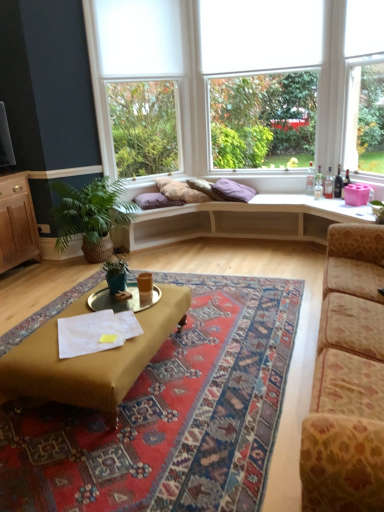
What do you see at coordinates (169, 415) in the screenshot? I see `carpeted rug at center` at bounding box center [169, 415].

In order to face green matte plant at center, which is the 2th houseplant in back-to-front order, should I rotate leftwards or rightwards?

To face it directly, rotate left by 10.085 degrees.

Locate an element on the screen. The image size is (384, 512). green matte plant at center, which is the 2th houseplant in back-to-front order is located at coordinates (116, 275).

What is the approximate height of purple fabric pillow at center, marked as the second pillow in a right-to-left arrangement?

purple fabric pillow at center, marked as the second pillow in a right-to-left arrangement, is 18.32 centimeters in height.

This screenshot has height=512, width=384. Find the location of `mustard fabric coffee table at center`. mustard fabric coffee table at center is located at coordinates (89, 359).

The height and width of the screenshot is (512, 384). I want to click on white fabric blind at upper center, so click(x=260, y=35).

How much space does green leafy plant at left, which is counted as the 2th houseplant, starting from the front, occupy vertically?

green leafy plant at left, which is counted as the 2th houseplant, starting from the front, is 32.29 inches tall.

Where is `carpeted rug at center`? The width and height of the screenshot is (384, 512). carpeted rug at center is located at coordinates (169, 415).

In the scene shown: Does metallic gold cocktail table at center have a greater height compared to purple fabric pillow at center, the 1th pillow in the left-to-right sequence?

No.

Considering the positions of point (152, 294) and point (155, 201), is point (152, 294) closer or farther from the camera than point (155, 201)?

Point (152, 294) is positioned closer to the camera compared to point (155, 201).

From the image's perspective, is metallic gold cocktail table at center located above purple fabric pillow at center, marked as the second pillow in a right-to-left arrangement?

No, from the image's perspective, metallic gold cocktail table at center is not over purple fabric pillow at center, marked as the second pillow in a right-to-left arrangement.

From the picture: Is purple fabric pillow at center, the 1th pillow in the left-to-right sequence, turned away from white fabric blind at upper center?

No, white fabric blind at upper center is not at the back of purple fabric pillow at center, the 1th pillow in the left-to-right sequence.

Can white fabric blind at upper center be found inside purple fabric pillow at center, the 1th pillow in the left-to-right sequence?

That's incorrect, white fabric blind at upper center is not inside purple fabric pillow at center, the 1th pillow in the left-to-right sequence.

Which object is positioned more to the left, purple fabric pillow at center, marked as the second pillow in a right-to-left arrangement, or white fabric blind at upper center?

purple fabric pillow at center, marked as the second pillow in a right-to-left arrangement, is more to the left.

Would you say purple fabric pillow at center, the 1th pillow in the left-to-right sequence, contains mustard fabric coffee table at center?

No, purple fabric pillow at center, the 1th pillow in the left-to-right sequence, does not contain mustard fabric coffee table at center.

Is purple fabric pillow at center, marked as the second pillow in a right-to-left arrangement, further to the viewer compared to mustard fabric coffee table at center?

Yes, purple fabric pillow at center, marked as the second pillow in a right-to-left arrangement, is behind mustard fabric coffee table at center.

Starting from the mustard fabric coffee table at center, which pillow is the 1st one to the right? Please provide its 2D coordinates.

[(155, 201)]

From the image's perspective, is purple fabric pillow at center, the 1th pillow in the left-to-right sequence, positioned above or below mustard fabric coffee table at center?

purple fabric pillow at center, the 1th pillow in the left-to-right sequence, is above mustard fabric coffee table at center.

How different are the orientations of carpeted rug at center and green matte plant at center, which is the 2th houseplant in back-to-front order, in degrees?

There is a 176-degree angle between the facing directions of carpeted rug at center and green matte plant at center, which is the 2th houseplant in back-to-front order.

From a real-world perspective, is carpeted rug at center positioned under green matte plant at center, acting as the first houseplant starting from the front, based on gravity?

Yes, from a real-world perspective, carpeted rug at center is beneath green matte plant at center, acting as the first houseplant starting from the front.

Between carpeted rug at center and green matte plant at center, acting as the first houseplant starting from the front, which one appears on the right side from the viewer's perspective?

carpeted rug at center is more to the right.

Is point (237, 289) farther from camera compared to point (126, 276)?

Yes, it is.

Would you say light wood futon at center is inside or outside mustard fabric coffee table at center?

light wood futon at center is not enclosed by mustard fabric coffee table at center.

Between point (206, 209) and point (155, 322), which one is positioned in front?

Positioned in front is point (155, 322).

From a real-world perspective, which object rests below the other?

From a 3D spatial view, mustard fabric coffee table at center is below.

How different are the orientations of light wood futon at center and mustard fabric coffee table at center in degrees?

88.6 degrees separate the facing orientations of light wood futon at center and mustard fabric coffee table at center.

Is leopard print fabric couch at right directly adjacent to purple cotton pillow at center, which is the 2th pillow from left to right?

No, leopard print fabric couch at right is not touching purple cotton pillow at center, which is the 2th pillow from left to right.

From the image's perspective, who appears lower, leopard print fabric couch at right or purple cotton pillow at center, positioned as the 1th pillow in right-to-left order?

leopard print fabric couch at right.

Does leopard print fabric couch at right contain purple cotton pillow at center, positioned as the 1th pillow in right-to-left order?

Actually, purple cotton pillow at center, positioned as the 1th pillow in right-to-left order, is outside leopard print fabric couch at right.

From the image's perspective, is white fabric blind at upper center located above or below green leafy plant at left, which is counted as the 2th houseplant, starting from the front?

Based on their image positions, white fabric blind at upper center is located above green leafy plant at left, which is counted as the 2th houseplant, starting from the front.

Who is smaller, white fabric blind at upper center or green leafy plant at left, which is counted as the 2th houseplant, starting from the front?

Smaller between the two is white fabric blind at upper center.

Is white fabric blind at upper center positioned with its back to green leafy plant at left, the first houseplant in the back-to-front sequence?

No, white fabric blind at upper center is not facing the opposite direction of green leafy plant at left, the first houseplant in the back-to-front sequence.

From a real-world perspective, which is physically above, white fabric blind at upper center or green leafy plant at left, the first houseplant in the back-to-front sequence?

From a 3D spatial view, white fabric blind at upper center is above.

Starting from the metallic gold cocktail table at center, which pillow is the 1st one behind? Please provide its 2D coordinates.

[(155, 201)]

This screenshot has height=512, width=384. Find the location of `blind above the purple fabric pillow at center, the 1th pillow in the left-to-right sequence (from a real-world perspective)`. blind above the purple fabric pillow at center, the 1th pillow in the left-to-right sequence (from a real-world perspective) is located at coordinates (260, 35).

Estimate the real-world distances between objects in this image. Which object is further from green leafy plant at left, the first houseplant in the back-to-front sequence, leopard print fabric couch at right or white fabric blind at upper center?

leopard print fabric couch at right is further to green leafy plant at left, the first houseplant in the back-to-front sequence.

Based on their spatial positions, is purple fabric pillow at center, marked as the second pillow in a right-to-left arrangement, or metallic gold cocktail table at center closer to green matte plant at center, which is the 2th houseplant in back-to-front order?

The object closer to green matte plant at center, which is the 2th houseplant in back-to-front order, is metallic gold cocktail table at center.

Looking at the image, which one is located further to white fabric blind at upper center, purple fabric pillow at center, marked as the second pillow in a right-to-left arrangement, or green matte plant at center, acting as the first houseplant starting from the front?

Based on the image, green matte plant at center, acting as the first houseplant starting from the front, appears to be further to white fabric blind at upper center.

Which object lies further to the anchor point green matte plant at center, which is the 2th houseplant in back-to-front order, wooden cabinet at left or purple cotton pillow at center, positioned as the 1th pillow in right-to-left order?

The object further to green matte plant at center, which is the 2th houseplant in back-to-front order, is purple cotton pillow at center, positioned as the 1th pillow in right-to-left order.

Considering their positions, is purple fabric pillow at center, marked as the second pillow in a right-to-left arrangement, positioned further to green matte plant at center, which is the 2th houseplant in back-to-front order, than leopard print fabric couch at right?

Among the two, purple fabric pillow at center, marked as the second pillow in a right-to-left arrangement, is located further to green matte plant at center, which is the 2th houseplant in back-to-front order.

Based on their spatial positions, is mustard fabric coffee table at center or carpeted rug at center closer to green matte plant at center, acting as the first houseplant starting from the front?

mustard fabric coffee table at center.

Which object lies further to the anchor point purple cotton pillow at center, positioned as the 1th pillow in right-to-left order, wooden cabinet at left or metallic gold cocktail table at center?

metallic gold cocktail table at center is positioned further to the anchor purple cotton pillow at center, positioned as the 1th pillow in right-to-left order.

Based on their spatial positions, is leopard print fabric couch at right or purple cotton pillow at center, which is the 2th pillow from left to right, further from white fabric blind at upper center?

leopard print fabric couch at right is further to white fabric blind at upper center.

This screenshot has width=384, height=512. In order to click on coffee table between leopard print fabric couch at right and light wood futon at center in the front-back direction in this screenshot , I will do `click(89, 359)`.

The height and width of the screenshot is (512, 384). In order to click on cocktail table located between carpeted rug at center and light wood futon at center in the depth direction in this screenshot , I will do `click(123, 301)`.

In order to click on futon between leopard print fabric couch at right and green leafy plant at left, the first houseplant in the back-to-front sequence, along the z-axis in this screenshot , I will do `click(240, 221)`.

At what (x,y) coordinates should I click in order to perform the action: click on coffee table positioned between carpeted rug at center and metallic gold cocktail table at center from near to far. Please return your answer as a coordinate pair (x, y). The image size is (384, 512). Looking at the image, I should click on (89, 359).